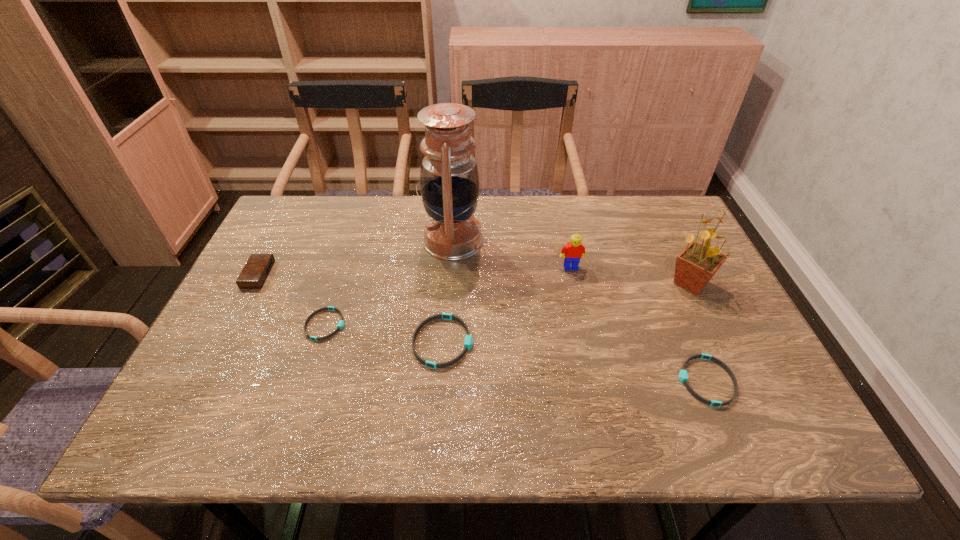
Locate an element on the screen. The height and width of the screenshot is (540, 960). free area in between the oil lamp and the leftmost wristband is located at coordinates (389, 283).

Find the location of `free spot between the leftmost object and the rightmost wristband`. free spot between the leftmost object and the rightmost wristband is located at coordinates (482, 328).

Identify the location of object that is the nearest to the oil lamp. This screenshot has width=960, height=540. (468, 342).

Choose which object is the sixth nearest neighbor to the leftmost wristband. Please provide its 2D coordinates. Your answer should be formatted as a tuple, i.e. [(x, y)], where the tuple contains the x and y coordinates of a point satisfying the conditions above.

[(695, 266)]

Identify which wristband is the second closest to the second tallest object. Please provide its 2D coordinates. Your answer should be formatted as a tuple, i.e. [(x, y)], where the tuple contains the x and y coordinates of a point satisfying the conditions above.

[(468, 342)]

Choose which wristband is the nearest neighbor to the tallest object. Please provide its 2D coordinates. Your answer should be formatted as a tuple, i.e. [(x, y)], where the tuple contains the x and y coordinates of a point satisfying the conditions above.

[(468, 342)]

Where is `vacant space that satisfies the following two spatial constraints: 1. on the front-facing side of the fifth object from left to right; 2. on the buckle of the shortest wristband`? vacant space that satisfies the following two spatial constraints: 1. on the front-facing side of the fifth object from left to right; 2. on the buckle of the shortest wristband is located at coordinates (584, 325).

Image resolution: width=960 pixels, height=540 pixels. In order to click on vacant space that satisfies the following two spatial constraints: 1. on the front-facing side of the third object from right to left; 2. on the buckle of the second wristband from left to right in this screenshot , I will do click(588, 342).

You are a GUI agent. You are given a task and a screenshot of the screen. Output one action in this format:
    pyautogui.click(x=<x>, y=<y>)
    Task: Click on the vacant space that satisfies the following two spatial constraints: 1. on the front side of the oil lamp; 2. on the front face of the alarm clock
    
    Given the screenshot: What is the action you would take?
    pyautogui.click(x=450, y=275)

You are a GUI agent. You are given a task and a screenshot of the screen. Output one action in this format:
    pyautogui.click(x=<x>, y=<y>)
    Task: Click on the vacant space that satisfies the following two spatial constraints: 1. on the front-facing side of the fifth object from left to right; 2. on the buckle of the tallest wristband
    The height and width of the screenshot is (540, 960).
    Given the screenshot: What is the action you would take?
    pyautogui.click(x=588, y=342)